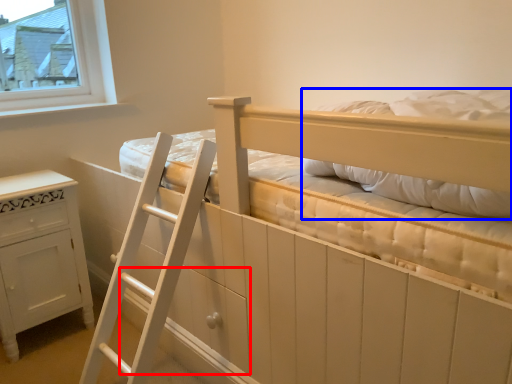
Question: Which of the following is the farthest to the observer, drawer (highlighted by a red box) or pillow (highlighted by a blue box)?

Choices:
 (A) drawer
 (B) pillow

Answer: (A)